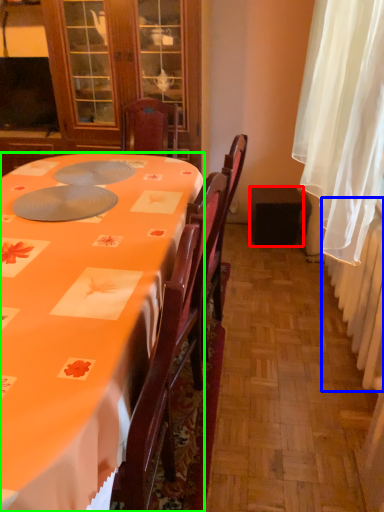
Question: Estimate the real-world distances between objects in this image. Which object is closer to loudspeaker (highlighted by a red box), radiator (highlighted by a blue box) or desk (highlighted by a green box)?

Choices:
 (A) radiator
 (B) desk

Answer: (A)